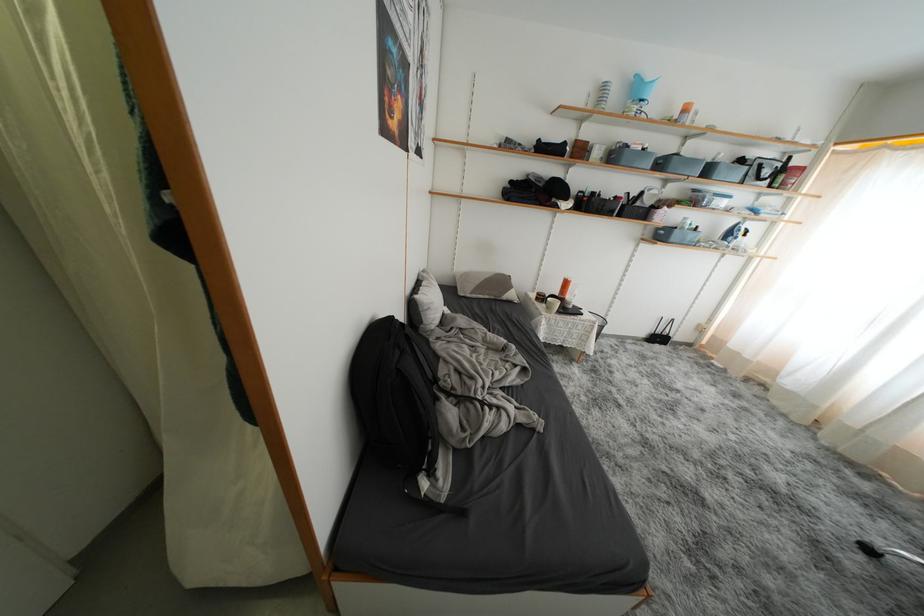
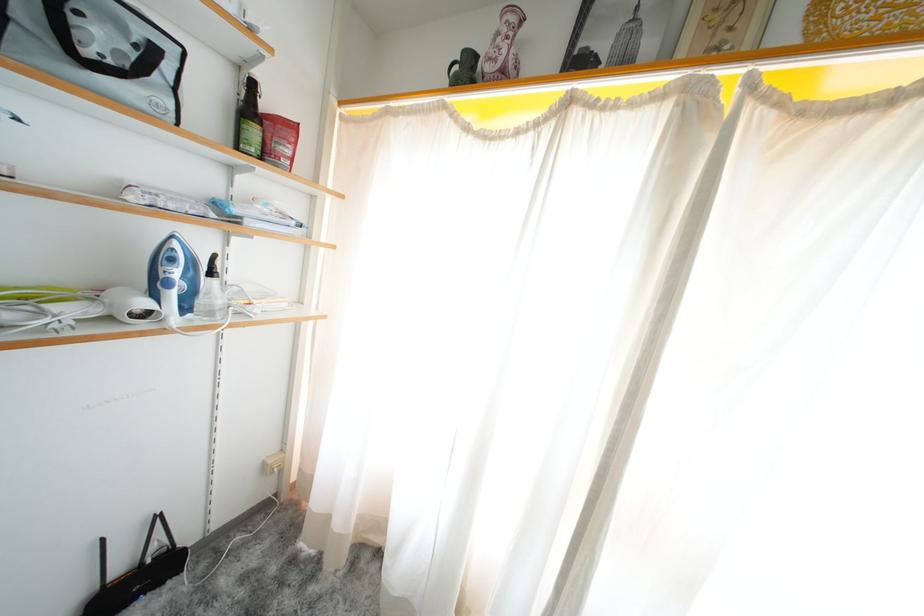
The point at (787, 182) is marked in the first image. Where is the corresponding point in the second image?

(261, 137)